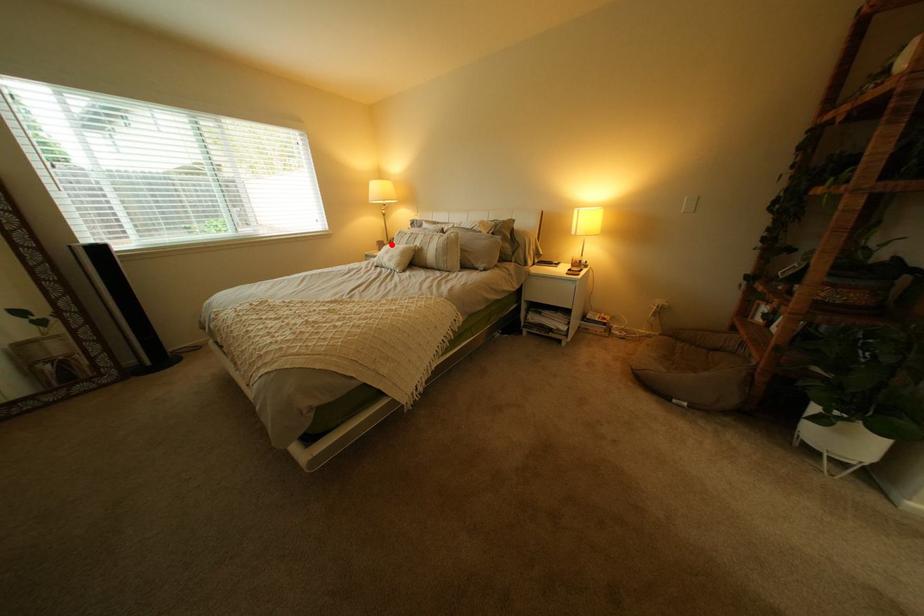
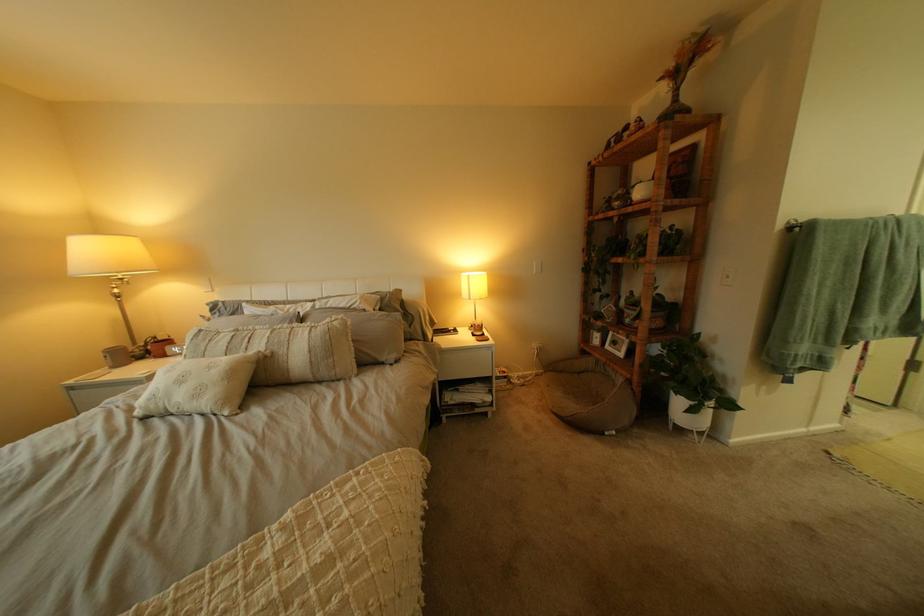
The point at the highlighted location is marked in the first image. Where is the corresponding point in the second image?

(116, 357)